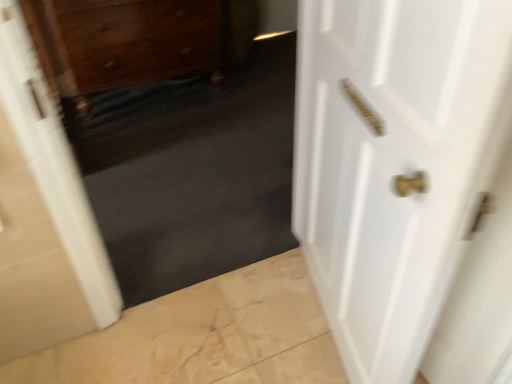
Question: Is point (133, 183) positioned closer to the camera than point (410, 0)?

Choices:
 (A) farther
 (B) closer

Answer: (A)

Question: Is dark matte carpet at center situated inside white glossy door at right or outside?

Choices:
 (A) outside
 (B) inside

Answer: (A)

Question: Which object is positioned closest to the dark matte carpet at center?

Choices:
 (A) wooden drawer at upper left
 (B) white glossy door at right

Answer: (A)

Question: Estimate the real-world distances between objects in this image. Which object is closer to the wooden drawer at upper left?

Choices:
 (A) dark matte carpet at center
 (B) white glossy door at right

Answer: (A)